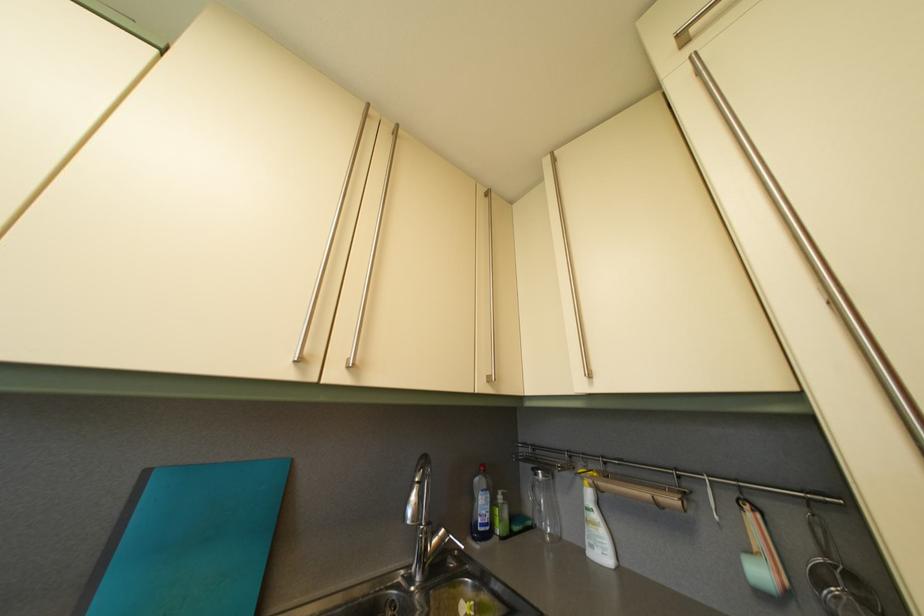
The image size is (924, 616). Identify the location of glass carafe. (544, 505).